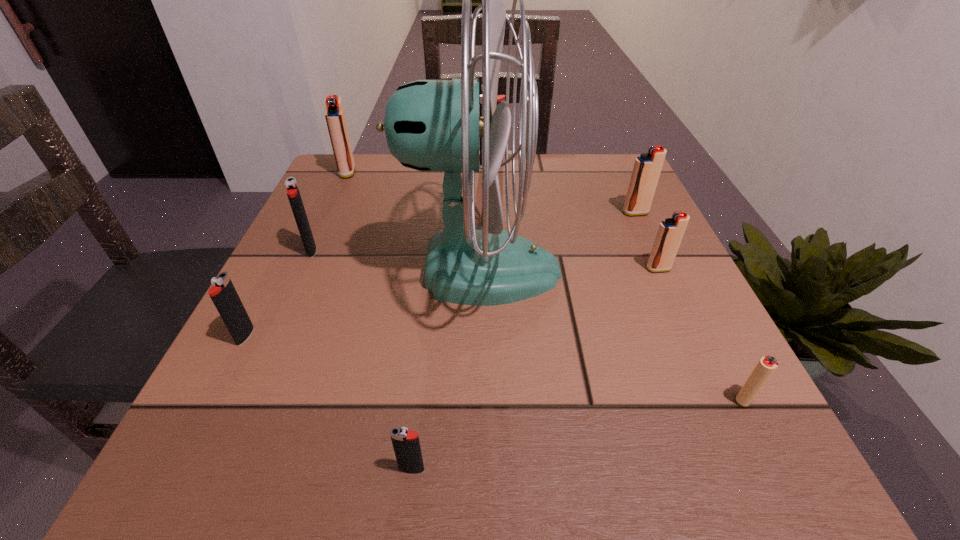
Locate an element on the screen. vacant space at the near edge is located at coordinates tap(366, 497).

Where is `vacant space at the left edge of the desktop`? The image size is (960, 540). vacant space at the left edge of the desktop is located at coordinates (336, 336).

This screenshot has height=540, width=960. Identify the location of vacant area at the right edge of the desktop. click(722, 335).

Locate an element on the screen. vacant space at the far left corner is located at coordinates (360, 188).

This screenshot has height=540, width=960. In the image, there is a desktop. Find the location of `vacant region at the near left corner`. vacant region at the near left corner is located at coordinates (296, 460).

Where is `vacant space at the far right corner of the desktop`? This screenshot has width=960, height=540. vacant space at the far right corner of the desktop is located at coordinates (594, 187).

The height and width of the screenshot is (540, 960). Find the location of `free space between the fan and the leftmost black igniter`. free space between the fan and the leftmost black igniter is located at coordinates (363, 303).

Locate an element on the screen. The image size is (960, 540). unoccupied area between the nearest object and the third biggest red igniter is located at coordinates (535, 369).

I want to click on vacant space that is in between the tallest object and the smallest red igniter, so click(612, 335).

Find the location of a particular element. This screenshot has width=960, height=540. free spot between the second smallest black igniter and the nearest object is located at coordinates (328, 402).